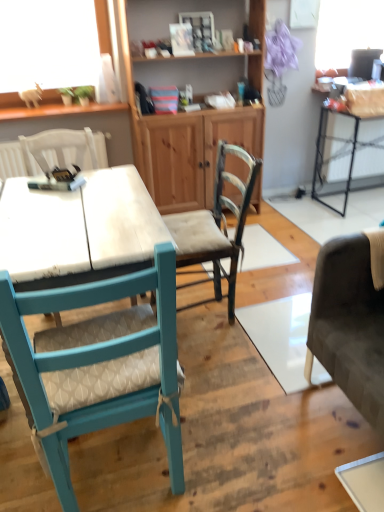
Question: Looking at their shapes, would you say wooden textured chair at center, arranged as the third chair when viewed from the left, is wider or thinner than metallic black table at right?

Choices:
 (A) thin
 (B) wide

Answer: (B)

Question: Considering the positions of wooden textured chair at center, positioned as the first chair in right-to-left order, and metallic black table at right in the image, is wooden textured chair at center, positioned as the first chair in right-to-left order, bigger or smaller than metallic black table at right?

Choices:
 (A) small
 (B) big

Answer: (A)

Question: Estimate the real-world distances between objects in this image. Which object is closer to the teal fabric chair at left, arranged as the second chair when viewed from the left?

Choices:
 (A) white fabric chair at upper left, which is the third chair from right to left
 (B) wooden cabinet at center
 (C) wooden textured chair at center, arranged as the third chair when viewed from the left
 (D) metallic black table at right

Answer: (C)

Question: Which is nearer to the white fabric chair at upper left, which is the third chair from right to left?

Choices:
 (A) wooden cabinet at center
 (B) wooden textured chair at center, positioned as the first chair in right-to-left order
 (C) teal fabric chair at left, arranged as the second chair when viewed from the left
 (D) metallic black table at right

Answer: (A)